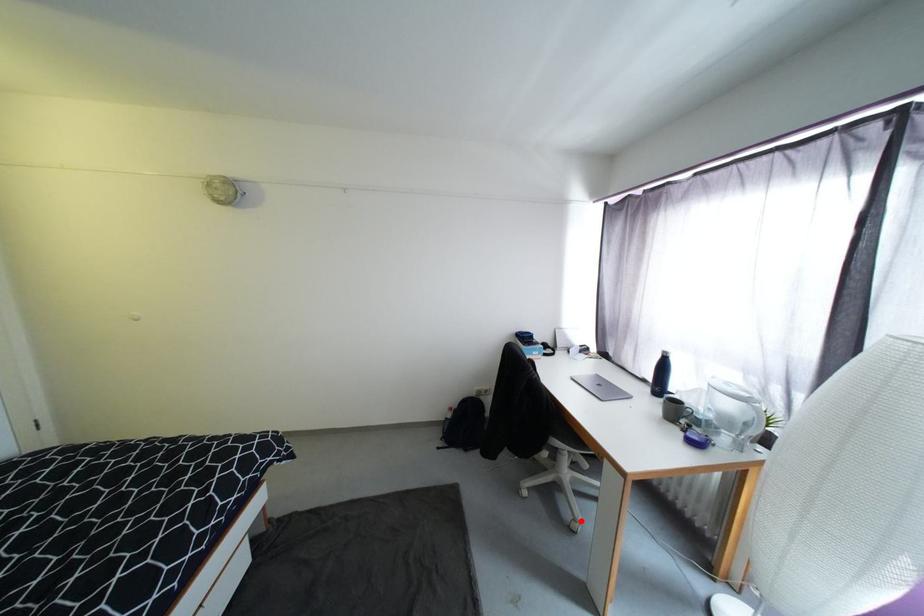
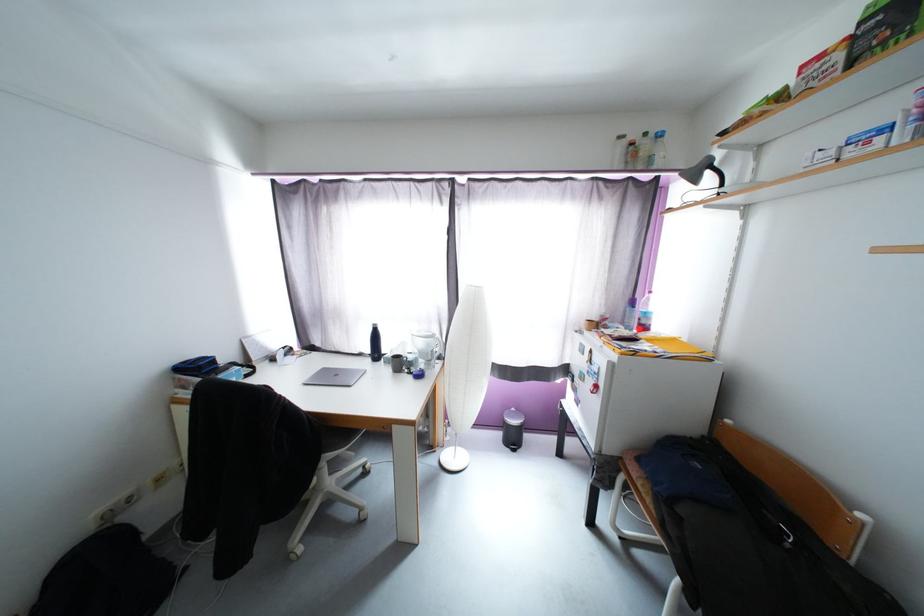
Question: I am providing you with two images of the same scene from different viewpoints. Given a red point in image1, look at the same physical point in image2. Is it:

Choices:
 (A) Closer to the viewpoint
 (B) Farther from the viewpoint

Answer: (A)